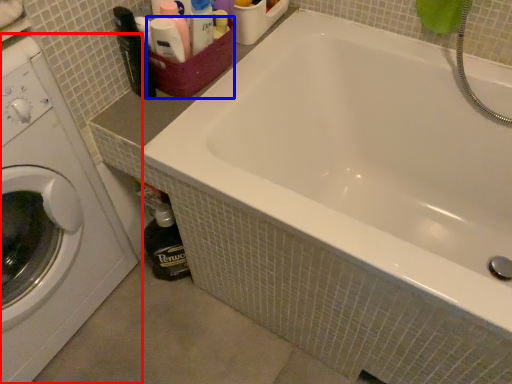
Question: Which point is further to the camera, washing machine (highlighted by a red box) or basket (highlighted by a blue box)?

Choices:
 (A) washing machine
 (B) basket

Answer: (B)